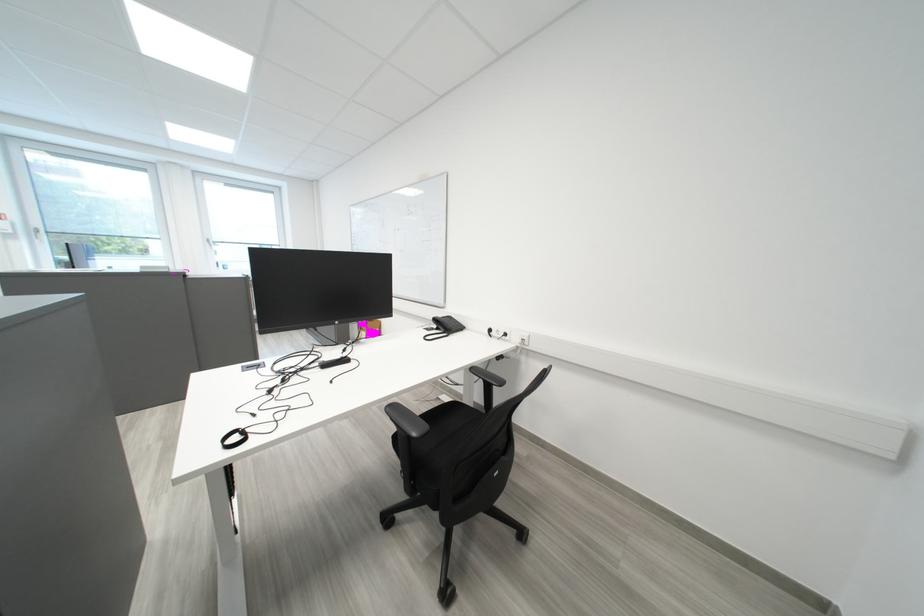
Where is `black phone handset`? The height and width of the screenshot is (616, 924). black phone handset is located at coordinates (444, 326).